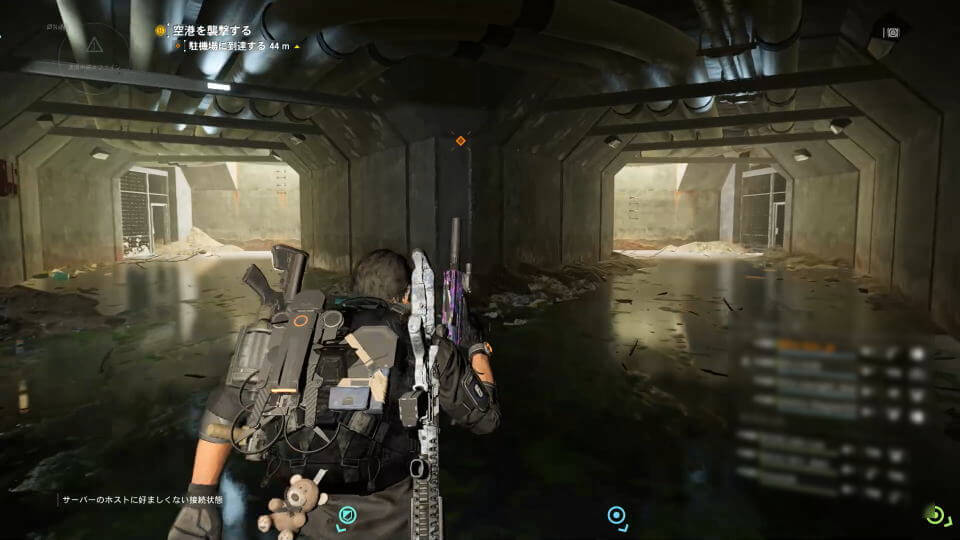
This screenshot has height=540, width=960. Identify the location of teddy bear. (292, 507).